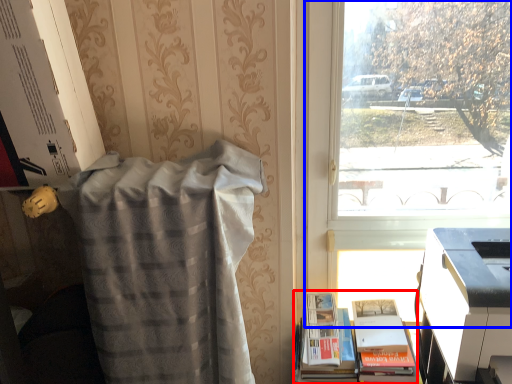
Question: Which of the following is the farthest to the observer, book (highlighted by a red box) or window (highlighted by a blue box)?

Choices:
 (A) book
 (B) window

Answer: (B)